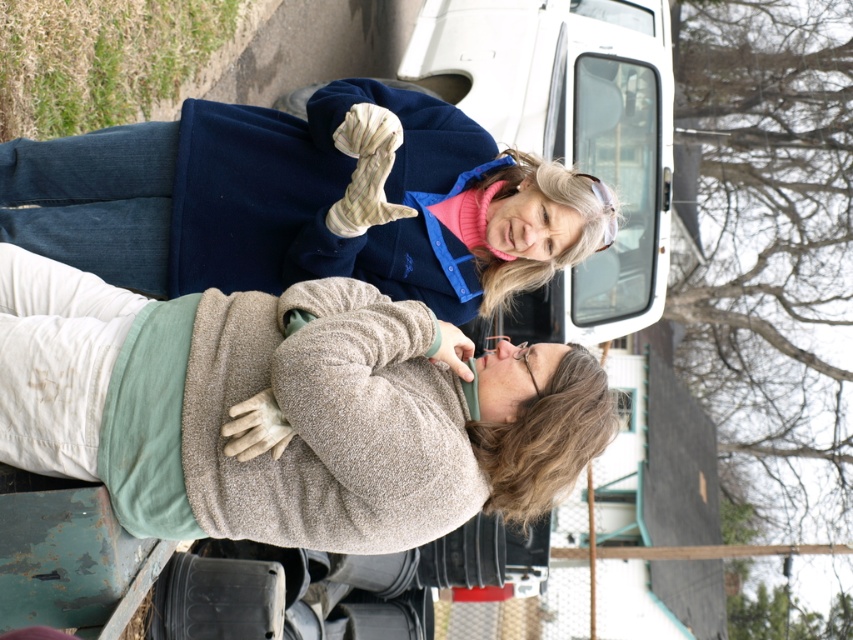
Looking at this image, you are a photographer trying to capture a photo of the beige fleece sweater at upper center. The camera is 4 meters away from the sweater. What should you do to ensure the sweater is in focus?

To ensure the beige fleece sweater at upper center is in focus, adjust the camera to a focal length that can capture objects at 4 meters distance. Alternatively, move closer to the sweater or use a zoom lens to focus at that distance.

You are a photographer trying to capture a wide shot of the blue fleece jacket at upper center and the white matte van at upper center. Based on their sizes, which object should you focus on to ensure both fit in the frame without cropping?

Since the blue fleece jacket at upper center is wider than the white matte van at upper center, you should focus on the blue fleece jacket at upper center to ensure both fit in the frame without cropping.